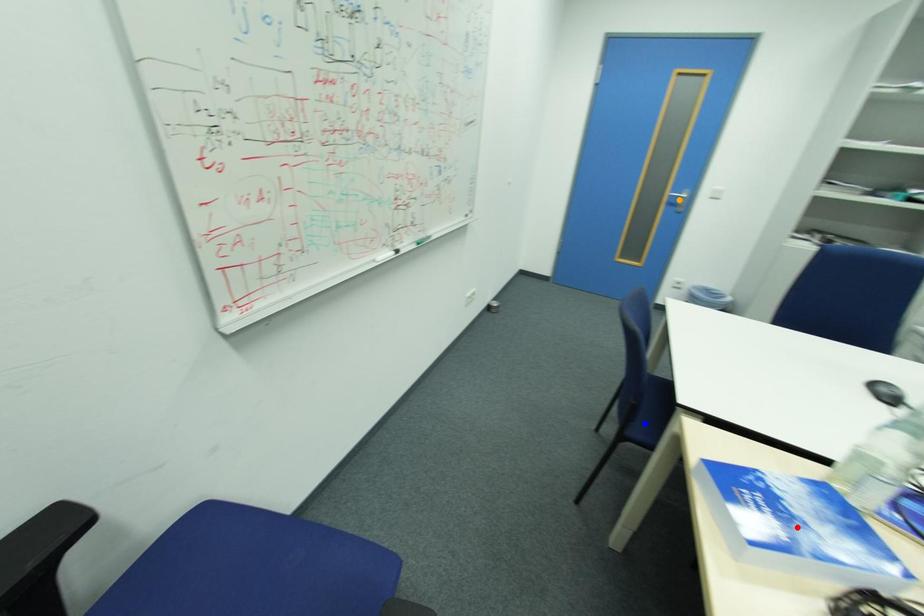
Order these from nearest to farthest:
red point | blue point | orange point

red point
blue point
orange point